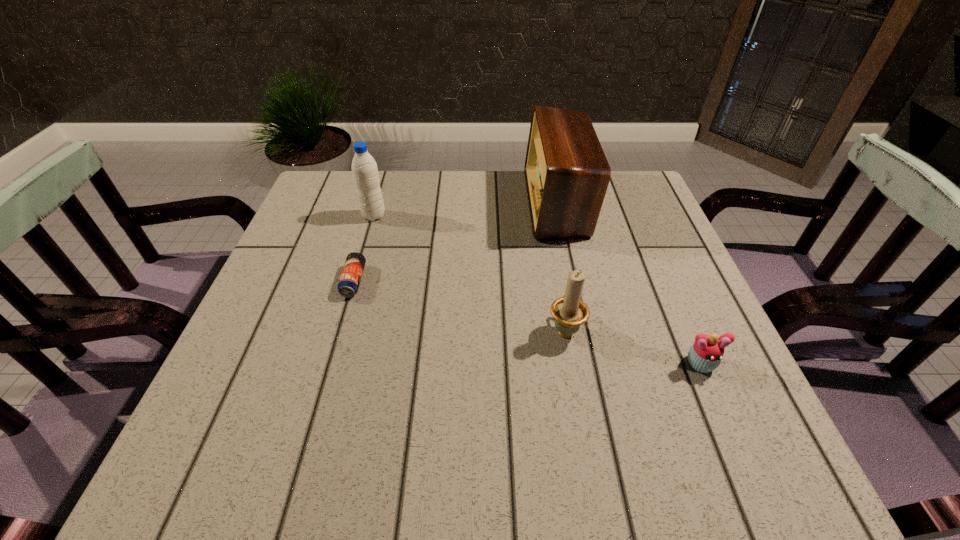
Where is `radio receiver`? radio receiver is located at coordinates (567, 174).

Locate an element on the screen. water bottle is located at coordinates (364, 168).

I want to click on the third shortest object, so click(x=569, y=312).

The image size is (960, 540). I want to click on candle_holder, so click(x=569, y=312).

The image size is (960, 540). I want to click on the rightmost object, so click(x=705, y=355).

Identify the location of cupcake. This screenshot has width=960, height=540. (705, 355).

You are a GUI agent. You are given a task and a screenshot of the screen. Output one action in this format:
    pyautogui.click(x=<x>, y=<y>)
    Task: Click on the beer can
    
    Given the screenshot: What is the action you would take?
    pyautogui.click(x=351, y=275)

The height and width of the screenshot is (540, 960). I want to click on the third nearest object, so click(x=351, y=275).

The image size is (960, 540). I want to click on free spot located 0.150m on the front-facing side of the radio receiver, so click(x=472, y=202).

Where is `free location located on the front-facing side of the radio receiver`? This screenshot has width=960, height=540. free location located on the front-facing side of the radio receiver is located at coordinates (420, 202).